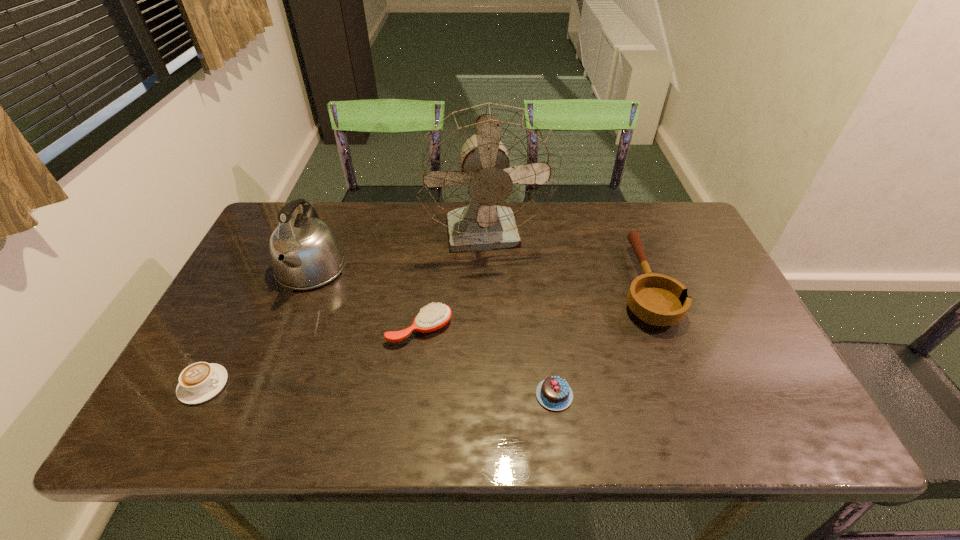
This screenshot has height=540, width=960. In order to click on free space at the far left corner in this screenshot , I will do `click(278, 208)`.

Locate an element on the screen. vacant space at the far right corner of the desktop is located at coordinates (661, 219).

What are the coordinates of `unoccupied area between the kettle and the cappuccino` in the screenshot? It's located at (257, 327).

Where is `free spot between the chocolate cake and the third tallest object`? This screenshot has height=540, width=960. free spot between the chocolate cake and the third tallest object is located at coordinates (599, 340).

At what (x,y) coordinates should I click in order to perform the action: click on free space between the fan and the fifth shortest object. Please return your answer as a coordinate pair (x, y). The width and height of the screenshot is (960, 540). Looking at the image, I should click on (398, 253).

The width and height of the screenshot is (960, 540). I want to click on free area in between the second tallest object and the tallest object, so click(x=398, y=253).

Identify the location of empty location between the fourth shortest object and the hairbrush. Image resolution: width=960 pixels, height=540 pixels. (532, 307).

You are a GUI agent. You are given a task and a screenshot of the screen. Output one action in this format:
    pyautogui.click(x=<x>, y=<y>)
    Task: Click on the free point between the hairbrush and the chocolate cake
    Image resolution: width=960 pixels, height=540 pixels.
    Given the screenshot: What is the action you would take?
    pyautogui.click(x=487, y=362)

The width and height of the screenshot is (960, 540). Identify the location of vacant area between the cappuccino and the second tallest object. (257, 327).

Where is `blank region between the fourth shortest object and the chocolate cake`? blank region between the fourth shortest object and the chocolate cake is located at coordinates (599, 340).